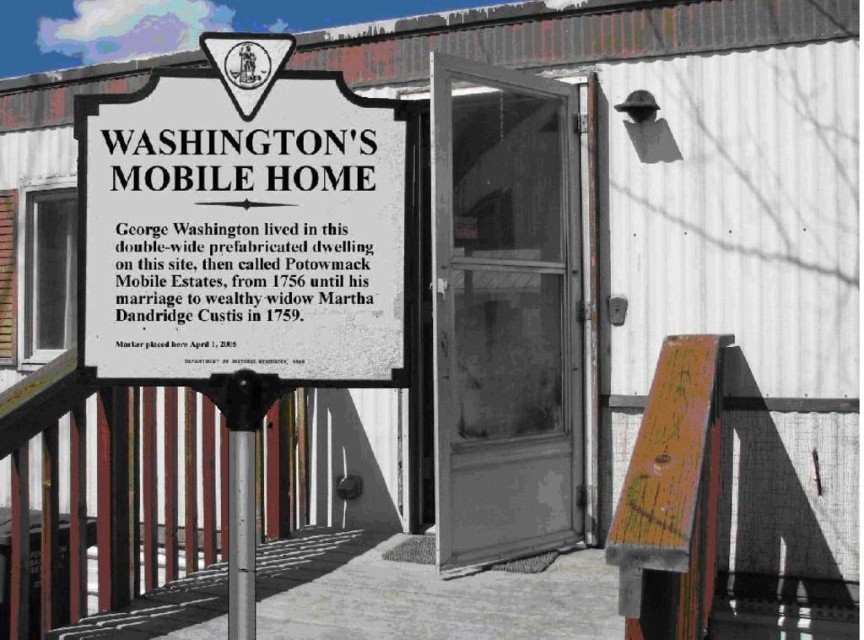
You are a tour guide explaining the historical marker to visitors. You notice the white paper sign at upper left and the silver metallic pole at left. Which object is larger in size?

The white paper sign at upper left is bigger than the silver metallic pole at left according to the description.

You are a tourist standing in front of the historical marker. You notice the white paper sign at upper left and the silver metallic pole at left. Which object is positioned more to the right?

The white paper sign at upper left is positioned more to the right than the silver metallic pole at left.